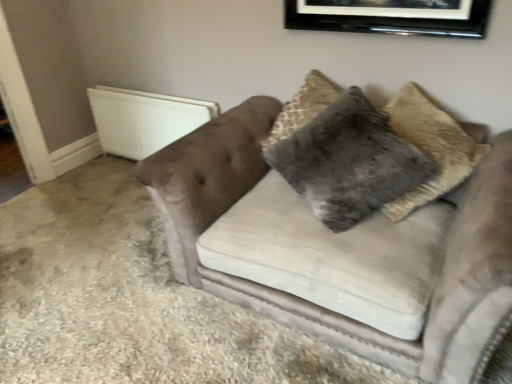
Question: Does velvet couch at center come in front of fuzzy gray pillow at center?

Choices:
 (A) no
 (B) yes

Answer: (B)

Question: Considering the relative positions of velvet couch at center and fuzzy gray pillow at center in the image provided, is velvet couch at center to the left of fuzzy gray pillow at center from the viewer's perspective?

Choices:
 (A) yes
 (B) no

Answer: (B)

Question: Is velvet couch at center smaller than fuzzy gray pillow at center?

Choices:
 (A) yes
 (B) no

Answer: (B)

Question: Considering the relative sizes of velvet couch at center and fuzzy gray pillow at center in the image provided, is velvet couch at center thinner than fuzzy gray pillow at center?

Choices:
 (A) yes
 (B) no

Answer: (B)

Question: From the image's perspective, is velvet couch at center located above fuzzy gray pillow at center?

Choices:
 (A) yes
 (B) no

Answer: (B)

Question: Does point (438, 31) appear closer or farther from the camera than point (352, 221)?

Choices:
 (A) farther
 (B) closer

Answer: (A)

Question: Do you think black glossy picture frame at upper center is within fuzzy gray pillow at center, or outside of it?

Choices:
 (A) outside
 (B) inside

Answer: (A)

Question: Is black glossy picture frame at upper center wider or thinner than fuzzy gray pillow at center?

Choices:
 (A) wide
 (B) thin

Answer: (B)

Question: From their relative heights in the image, would you say black glossy picture frame at upper center is taller or shorter than fuzzy gray pillow at center?

Choices:
 (A) short
 (B) tall

Answer: (A)

Question: Is white plastic radiator at left inside or outside of fuzzy gray pillow at center?

Choices:
 (A) outside
 (B) inside

Answer: (A)

Question: Based on their sizes in the image, would you say white plastic radiator at left is bigger or smaller than fuzzy gray pillow at center?

Choices:
 (A) small
 (B) big

Answer: (A)

Question: From a real-world perspective, relative to fuzzy gray pillow at center, is white plastic radiator at left vertically above or below?

Choices:
 (A) above
 (B) below

Answer: (B)

Question: From the image's perspective, is white plastic radiator at left above or below fuzzy gray pillow at center?

Choices:
 (A) below
 (B) above

Answer: (B)

Question: Is velvet couch at center inside the boundaries of black glossy picture frame at upper center, or outside?

Choices:
 (A) inside
 (B) outside

Answer: (B)

Question: Is velvet couch at center in front of or behind black glossy picture frame at upper center in the image?

Choices:
 (A) behind
 (B) front

Answer: (B)